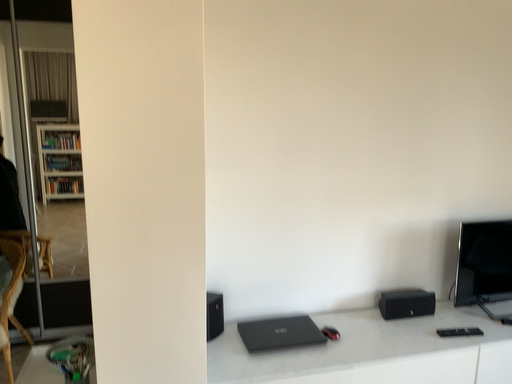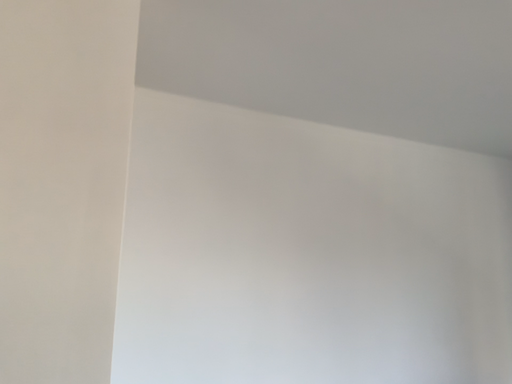
Question: How did the camera likely rotate when shooting the video?

Choices:
 (A) rotated left
 (B) rotated right

Answer: (B)